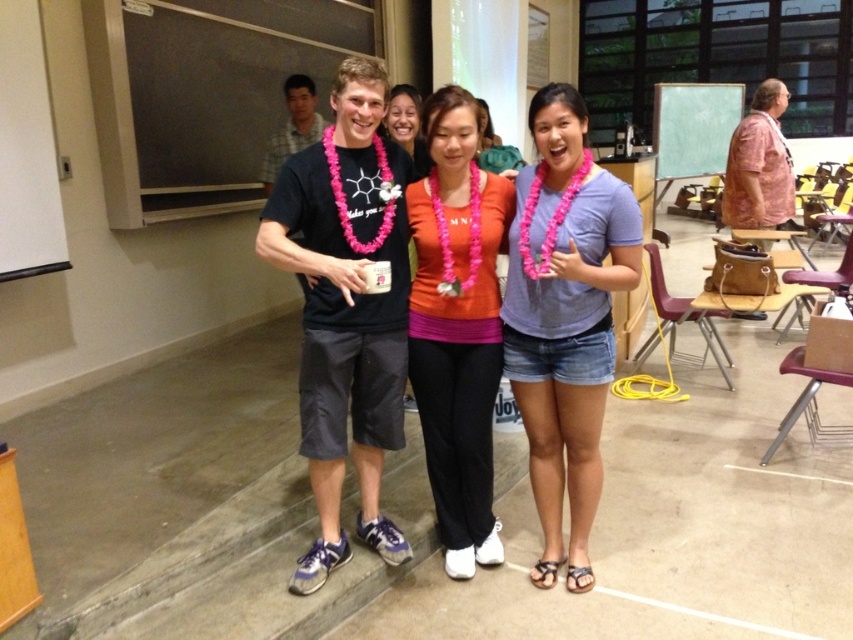
You are taking a photo of two points in a classroom scene. The first point is at coordinates point (x=473, y=179) and the second is at point (x=766, y=129). Based on the scene description, which point is closer to the camera?

Point (x=473, y=179) is closer to the camera than point (x=766, y=129).

You are a photographer standing in the middle of the room. You want to take a photo that includes both the orange fabric shirt at center and the pink floral shirt at right. Given that your camera has a maximum focus range of 3 meters, will you be able to capture both subjects clearly in the same frame?

The orange fabric shirt at center and pink floral shirt at right are 3.35 meters apart from each other. Since the distance between them exceeds the camera maximum focus range of 3 meters, the photographer will not be able to capture both subjects clearly in the same frame.